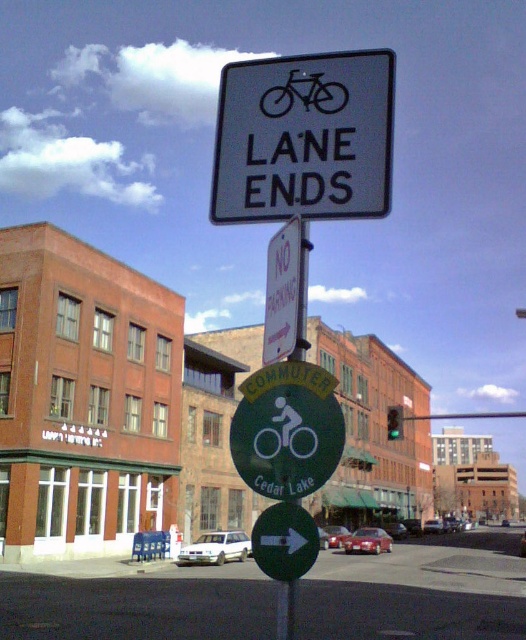
Question: Can you confirm if white plastic sign at upper center is positioned below black rubber bicycle at upper center?

Choices:
 (A) yes
 (B) no

Answer: (B)

Question: Estimate the real-world distances between objects in this image. Which object is closer to the green matte sign at center?

Choices:
 (A) white plastic sign at upper center
 (B) black rubber bicycle at upper center

Answer: (A)

Question: Can you confirm if white plastic sign at upper center is smaller than green matte sign at center?

Choices:
 (A) yes
 (B) no

Answer: (A)

Question: Is white plastic sign at upper center bigger than black rubber bicycle at upper center?

Choices:
 (A) yes
 (B) no

Answer: (A)

Question: Among these points, which one is farthest from the camera?

Choices:
 (A) (284, 81)
 (B) (256, 584)

Answer: (B)

Question: Which object is the farthest from the black rubber bicycle at upper center?

Choices:
 (A) white plastic sign at upper center
 (B) green matte sign at center

Answer: (B)